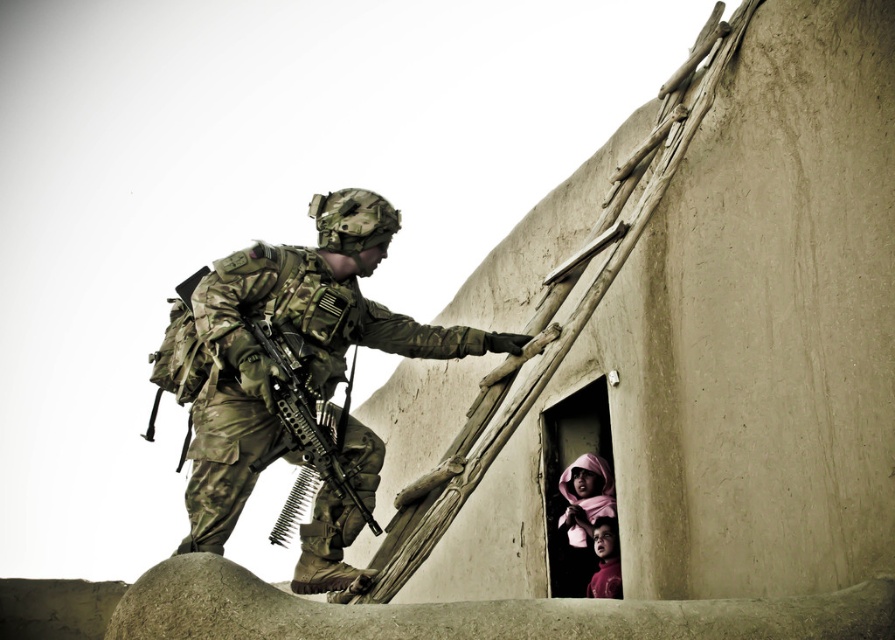
Where is the camouflage uniform at center located in the image?

The camouflage uniform at center is located at point (297, 336) in the image.